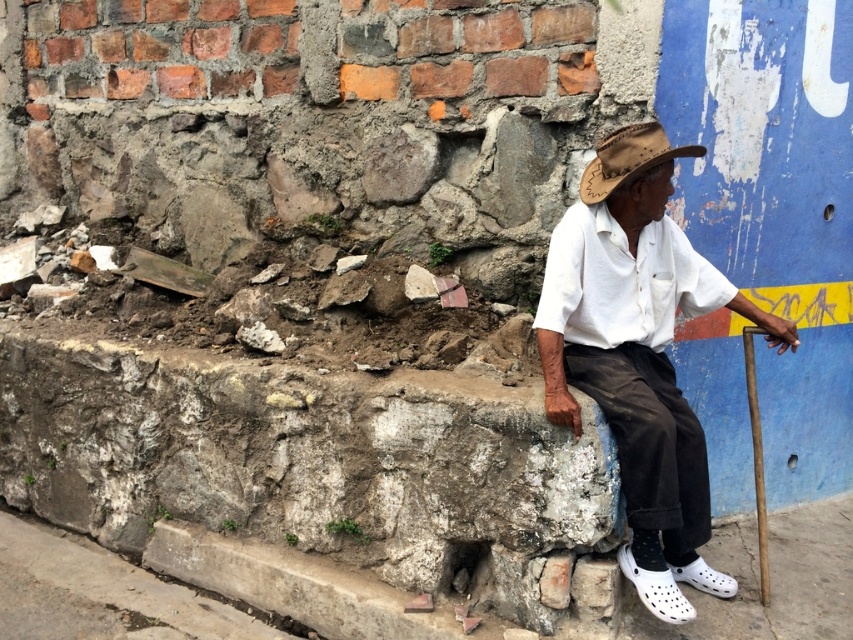
Does white cotton shirt at center have a greater height compared to brown leather cowboy hat at center?

Yes, white cotton shirt at center is taller than brown leather cowboy hat at center.

Can you confirm if white cotton shirt at center is positioned above brown leather cowboy hat at center?

No, white cotton shirt at center is not above brown leather cowboy hat at center.

Is point (618, 452) closer to camera compared to point (659, 128)?

Yes, it is in front of point (659, 128).

At what (x,y) coordinates should I click in order to perform the action: click on white cotton shirt at center. Please return your answer as a coordinate pair (x, y). Looking at the image, I should click on (636, 348).

Does white cotton shirt at center have a greater width compared to white croc shoes at lower center?

Yes.

Is white cotton shirt at center above white croc shoes at lower center?

Correct, white cotton shirt at center is located above white croc shoes at lower center.

Does point (651, 420) come in front of point (664, 584)?

Yes, it is.

Identify the location of white cotton shirt at center. (636, 348).

How far apart are white croc shoes at lower center and white croc at lower right?

white croc shoes at lower center is 8.41 inches away from white croc at lower right.

Based on the photo, can you confirm if white croc shoes at lower center is positioned to the left of white croc at lower right?

Correct, you'll find white croc shoes at lower center to the left of white croc at lower right.

This screenshot has width=853, height=640. In order to click on white croc shoes at lower center in this screenshot , I will do `click(656, 589)`.

The height and width of the screenshot is (640, 853). I want to click on white croc shoes at lower center, so click(656, 589).